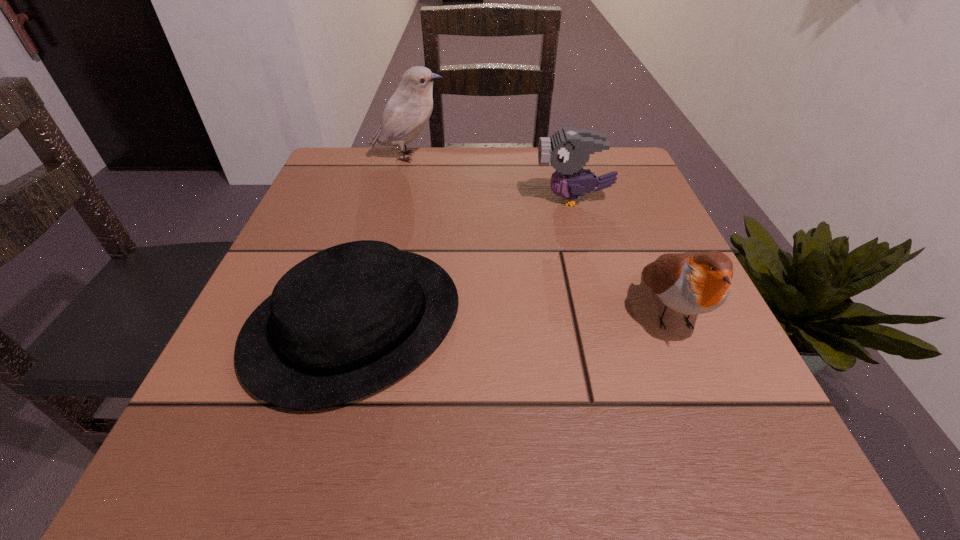
You are a GUI agent. You are given a task and a screenshot of the screen. Output one action in this format:
    pyautogui.click(x=<x>, y=<y>)
    Task: Click on the free space between the tallest object and the third nearest object
    
    Given the screenshot: What is the action you would take?
    pyautogui.click(x=491, y=178)

Locate an element on the screen. The width and height of the screenshot is (960, 540). the closest object to the third nearest object is located at coordinates (692, 283).

Locate an element on the screen. The image size is (960, 540). object that is the closest to the leftmost bird is located at coordinates (568, 149).

The height and width of the screenshot is (540, 960). Identify the location of bird that is the second closest to the leftmost bird. (692, 283).

Point out which bird is positioned as the second nearest to the fedora. Please provide its 2D coordinates. Your answer should be formatted as a tuple, i.e. [(x, y)], where the tuple contains the x and y coordinates of a point satisfying the conditions above.

[(692, 283)]

Find the location of a particular element. This screenshot has height=540, width=960. vacant space that satisfies the following two spatial constraints: 1. at the beak of the leftmost bird; 2. on the front side of the shortest object is located at coordinates (368, 322).

The height and width of the screenshot is (540, 960). What are the coordinates of `vacant space that satisfies the following two spatial constraints: 1. at the beak of the farthest bird; 2. on the front side of the fedora` in the screenshot? It's located at (368, 322).

Locate an element on the screen. This screenshot has width=960, height=540. vacant area that satisfies the following two spatial constraints: 1. at the beak of the tallest object; 2. on the front side of the shortest object is located at coordinates pos(368,322).